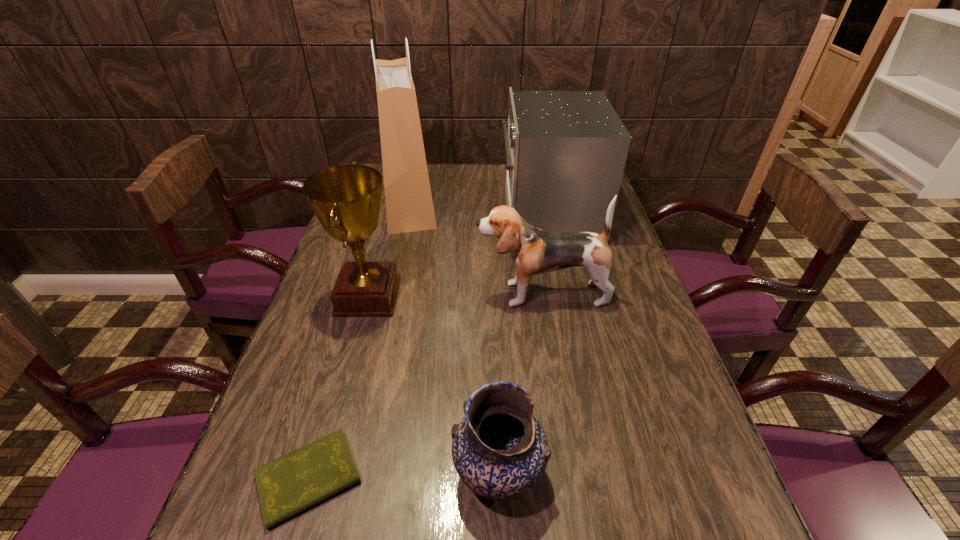
The width and height of the screenshot is (960, 540). In order to click on free space that satisfies the following two spatial constraints: 1. on the plaque of the award; 2. on the back side of the pottery in this screenshot , I will do `click(319, 474)`.

Find the location of `vacant space that satisfies the following two spatial constraints: 1. on the front panel of the toaster oven; 2. on the front side of the shortest object`. vacant space that satisfies the following two spatial constraints: 1. on the front panel of the toaster oven; 2. on the front side of the shortest object is located at coordinates (605, 479).

The image size is (960, 540). I want to click on vacant position in the image that satisfies the following two spatial constraints: 1. on the back side of the shortest object; 2. on the left side of the shopping bag, so tap(390, 202).